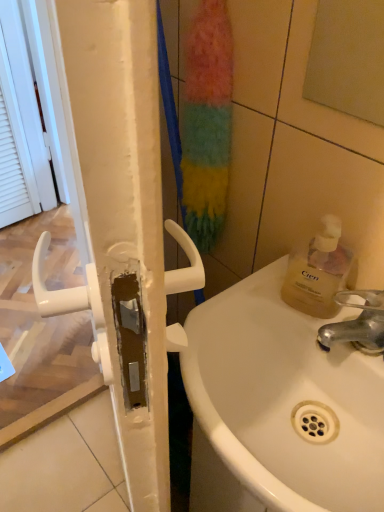
Identify the location of white plastic screen door at left. (50, 130).

What do you see at coordinates (122, 208) in the screenshot?
I see `white plastic handle at left` at bounding box center [122, 208].

In order to click on matte glass mirror at upper right in this screenshot , I will do `click(348, 58)`.

Image resolution: width=384 pixels, height=512 pixels. Find the location of `translucent yellow liquid at sink right`. translucent yellow liquid at sink right is located at coordinates (318, 272).

From the picture: Is translucent yellow liquid at sink right positioned behind silver metallic faucet at sink right?

Yes, the depth of translucent yellow liquid at sink right is greater than that of silver metallic faucet at sink right.

Considering the sizes of translucent yellow liquid at sink right and silver metallic faucet at sink right in the image, is translucent yellow liquid at sink right wider or thinner than silver metallic faucet at sink right?

Clearly, translucent yellow liquid at sink right has less width compared to silver metallic faucet at sink right.

What's the angular difference between translucent yellow liquid at sink right and silver metallic faucet at sink right's facing directions?

There is a 0.00128-degree angle between the facing directions of translucent yellow liquid at sink right and silver metallic faucet at sink right.

Is translucent yellow liquid at sink right bigger than silver metallic faucet at sink right?

Indeed, translucent yellow liquid at sink right has a larger size compared to silver metallic faucet at sink right.

Between white plastic handle at left and translucent yellow liquid at sink right, which one is positioned behind?

translucent yellow liquid at sink right is more distant.

At what (x,y) coordinates should I click in order to perform the action: click on shower door in front of the translucent yellow liquid at sink right. Please return your answer as a coordinate pair (x, y). Image resolution: width=384 pixels, height=512 pixels. Looking at the image, I should click on (122, 208).

From the picture: From the image's perspective, is white plastic handle at left above or below translucent yellow liquid at sink right?

From the image's perspective, white plastic handle at left appears below translucent yellow liquid at sink right.

From the image's perspective, between silver metallic faucet at sink right and white glossy sink at center, which one is located above?

silver metallic faucet at sink right is shown above in the image.

From a real-world perspective, is silver metallic faucet at sink right under white glossy sink at center?

No, from a real-world perspective, silver metallic faucet at sink right is not below white glossy sink at center.

Which is closer, (337, 333) or (276, 438)?

Clearly, point (337, 333) is closer to the camera than point (276, 438).

Can you confirm if white glossy sink at center is wider than silver metallic faucet at sink right?

Indeed, white glossy sink at center has a greater width compared to silver metallic faucet at sink right.

Is white glossy sink at center with silver metallic faucet at sink right?

No, white glossy sink at center is not touching silver metallic faucet at sink right.

This screenshot has width=384, height=512. What are the coordinates of `tap that is above the white glossy sink at center (from a real-world perspective)` in the screenshot? It's located at (357, 323).

Would you say white plastic handle at left is a long distance from white plastic screen door at left?

That's right, there is a large distance between white plastic handle at left and white plastic screen door at left.

Is white plastic handle at left thinner than white plastic screen door at left?

Yes.

From a real-world perspective, which is physically above, white plastic handle at left or white plastic screen door at left?

In real-world perspective, white plastic handle at left is above.

Is the depth of matte glass mirror at upper right greater than that of white glossy sink at center?

No, matte glass mirror at upper right is closer to the viewer.

Between point (382, 84) and point (219, 436), which one is positioned in front?

The point (219, 436) is closer.

At what (x,y) coordinates should I click in order to perform the action: click on mirror that appears above the white glossy sink at center (from a real-world perspective). Please return your answer as a coordinate pair (x, y). This screenshot has height=512, width=384. Looking at the image, I should click on (348, 58).

From the image's perspective, between matte glass mirror at upper right and white glossy sink at center, which one is located above?

From the image's view, matte glass mirror at upper right is above.

Where is `tap that appears below the matte glass mirror at upper right (from a real-world perspective)`? The width and height of the screenshot is (384, 512). tap that appears below the matte glass mirror at upper right (from a real-world perspective) is located at coordinates (357, 323).

Does silver metallic faucet at sink right turn towards matte glass mirror at upper right?

No, silver metallic faucet at sink right is not oriented towards matte glass mirror at upper right.

Is silver metallic faucet at sink right taller or shorter than matte glass mirror at upper right?

In the image, silver metallic faucet at sink right appears to be shorter than matte glass mirror at upper right.

You are a GUI agent. You are given a task and a screenshot of the screen. Output one action in this format:
    pyautogui.click(x=<x>, y=<y>)
    Task: Click on the bottle on the left of silver metallic faucet at sink right
    
    Given the screenshot: What is the action you would take?
    pyautogui.click(x=318, y=272)

This screenshot has height=512, width=384. Identify the location of shower door lying in front of the translucent yellow liquid at sink right. (122, 208).

When comparing their distances from white plastic handle at left, does white glossy sink at center or white plastic screen door at left seem closer?

Based on the image, white glossy sink at center appears to be nearer to white plastic handle at left.

Considering their positions, is white glossy sink at center positioned closer to translucent yellow liquid at sink right than matte glass mirror at upper right?

white glossy sink at center.

Looking at the image, which one is located closer to matte glass mirror at upper right, white plastic screen door at left or translucent yellow liquid at sink right?

Among the two, translucent yellow liquid at sink right is located nearer to matte glass mirror at upper right.

From the image, which object appears to be nearer to matte glass mirror at upper right, white plastic screen door at left or white glossy sink at center?

white glossy sink at center is positioned closer to the anchor matte glass mirror at upper right.

Estimate the real-world distances between objects in this image. Which object is further from white glossy sink at center, translucent yellow liquid at sink right or matte glass mirror at upper right?

matte glass mirror at upper right is positioned further to the anchor white glossy sink at center.

Looking at the image, which one is located further to white plastic screen door at left, white glossy sink at center or silver metallic faucet at sink right?

silver metallic faucet at sink right is positioned further to the anchor white plastic screen door at left.

When comparing their distances from matte glass mirror at upper right, does white plastic handle at left or white glossy sink at center seem further?

white plastic handle at left lies further to matte glass mirror at upper right than the other object.

Which object lies further to the anchor point silver metallic faucet at sink right, white glossy sink at center or white plastic handle at left?

The object further to silver metallic faucet at sink right is white plastic handle at left.

Locate an element on the screen. tap between white plastic handle at left and white plastic screen door at left in the front-back direction is located at coordinates (357, 323).

Identify the location of bottle between matte glass mirror at upper right and white plastic screen door at left from front to back. The width and height of the screenshot is (384, 512). (318, 272).

I want to click on tap that lies between matte glass mirror at upper right and white glossy sink at center from top to bottom, so click(357, 323).

Locate an element on the screen. sink situated between white plastic handle at left and translucent yellow liquid at sink right from left to right is located at coordinates (284, 399).